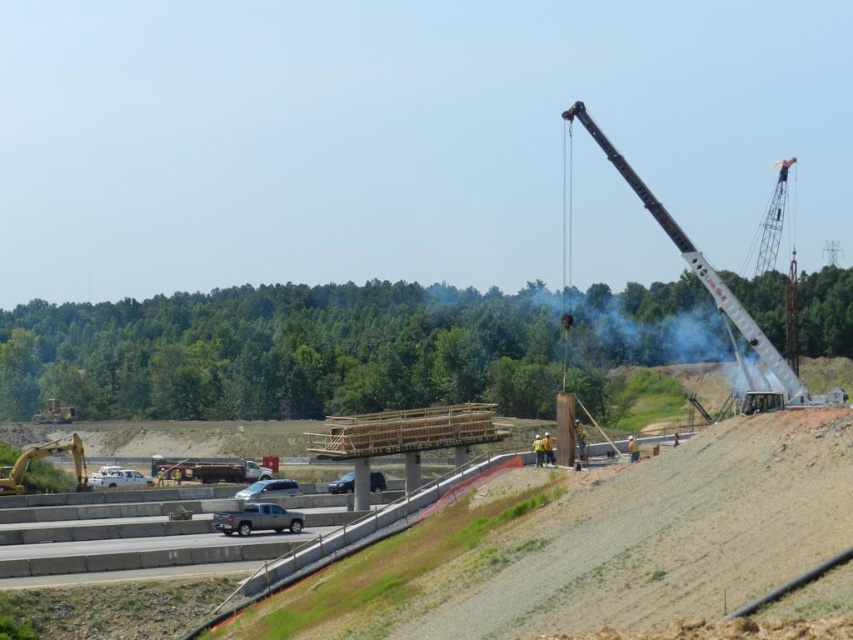
Question: Among these points, which one is nearest to the camera?

Choices:
 (A) (86, 484)
 (B) (144, 484)
 (C) (293, 532)

Answer: (C)

Question: From the image, what is the correct spatial relationship of black metallic crane at right in relation to white matte van at lower left?

Choices:
 (A) left
 (B) right

Answer: (B)

Question: Can you confirm if silver metallic car at center is bigger than satin black suv at center?

Choices:
 (A) no
 (B) yes

Answer: (A)

Question: Which of the following is the farthest from the observer?

Choices:
 (A) (0, 483)
 (B) (581, 113)
 (C) (109, 468)
 (D) (276, 488)

Answer: (C)

Question: Can you confirm if silver metallic truck at lower center is bigger than silver metallic car at center?

Choices:
 (A) yes
 (B) no

Answer: (B)

Question: Which object is farther from the camera taking this photo?

Choices:
 (A) silver metallic truck at lower center
 (B) satin black suv at center

Answer: (B)